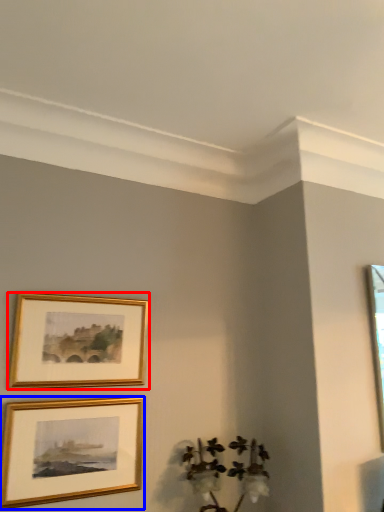
Question: Which of the following is the closest to the observer, picture frame (highlighted by a red box) or picture frame (highlighted by a blue box)?

Choices:
 (A) picture frame
 (B) picture frame

Answer: (B)